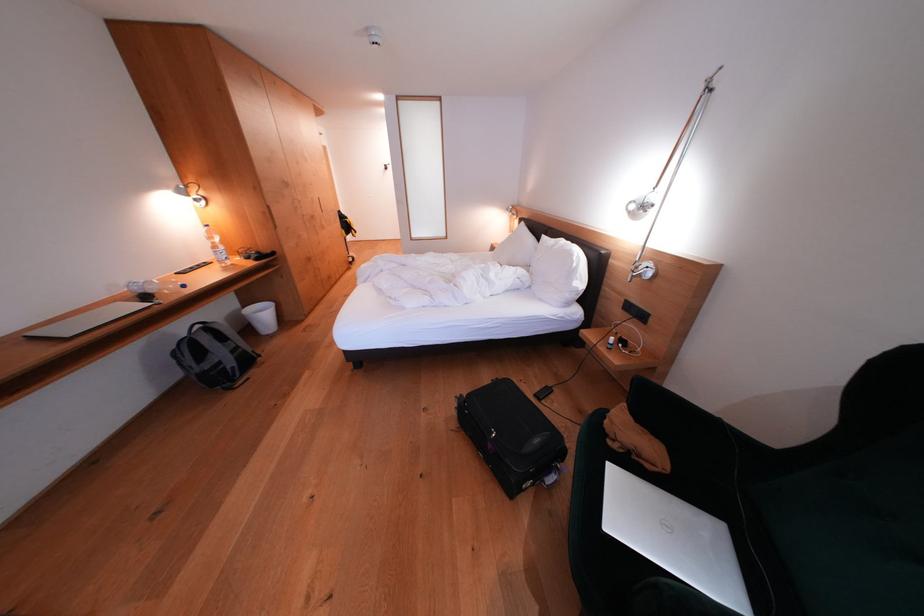
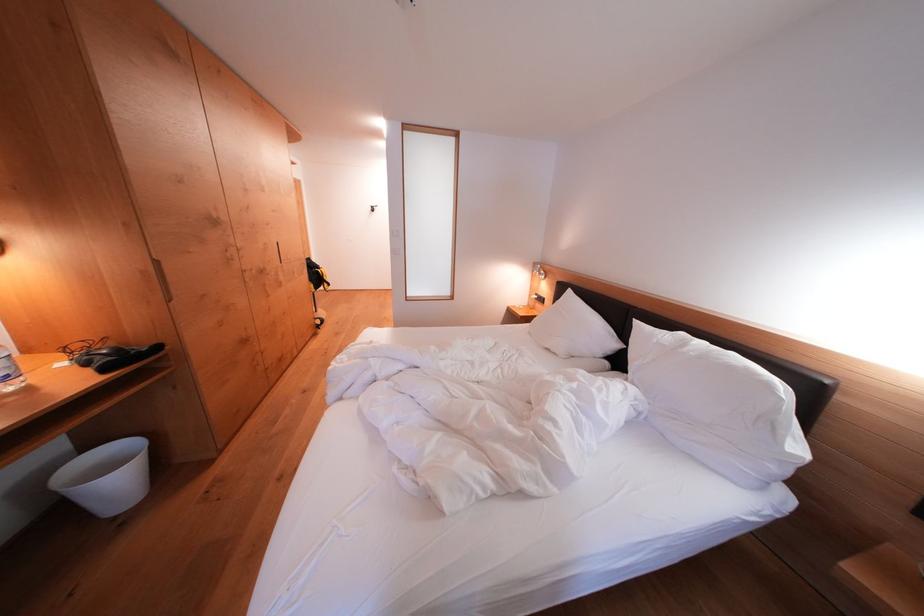
Looking at this image, the images are taken continuously from a first-person perspective. In which direction are you moving?

The cameraman moved toward left, forward.